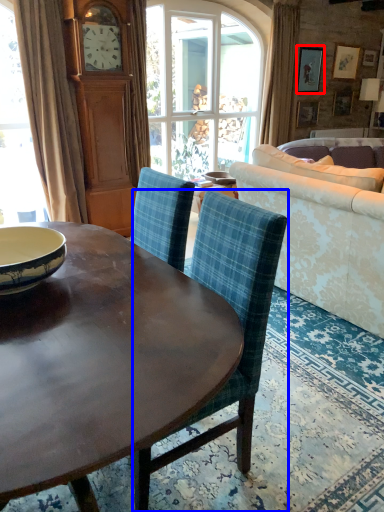
Question: Which point is further to the camera, picture frame (highlighted by a red box) or chair (highlighted by a blue box)?

Choices:
 (A) picture frame
 (B) chair

Answer: (A)